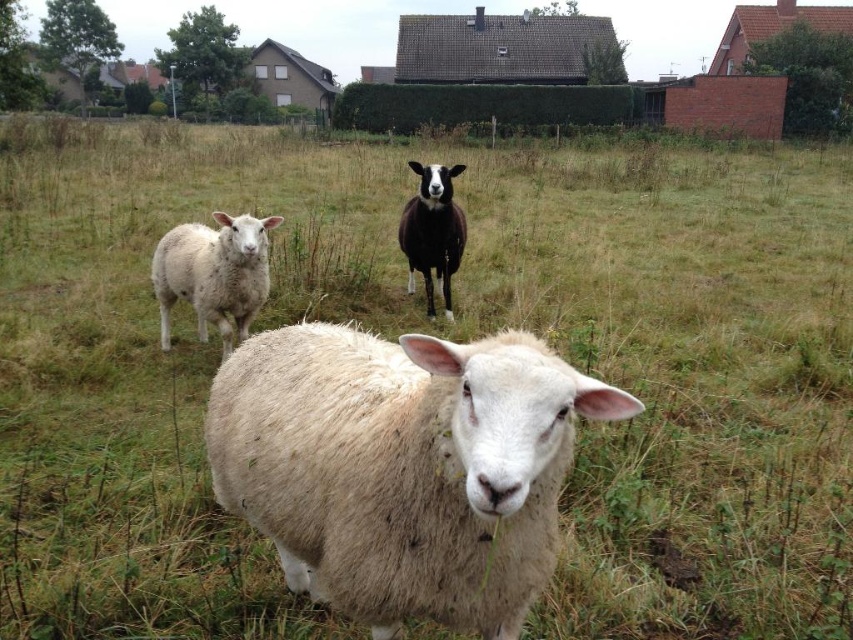
You are standing in a grassy field and want to reach a point that is 1.83 meters away from you. The point is marked as point (305, 484) in the image. Can you estimate how far you need to walk to reach that point?

The distance between you and point (305, 484) is exactly 1.83 meters, so you need to walk 1.83 meters to reach it.

You are standing in the field and want to walk to the closest point between point (483, 477) and point (206, 275). Which point should you head towards first?

You should head towards point (483, 477) first because it is closer to you than point (206, 275).

You are a farmer who wants to identify which sheep is taller. You see the white woolen sheep at left and the black woolen sheep at center. Which one is taller?

The black woolen sheep at center is taller than the white woolen sheep at left.